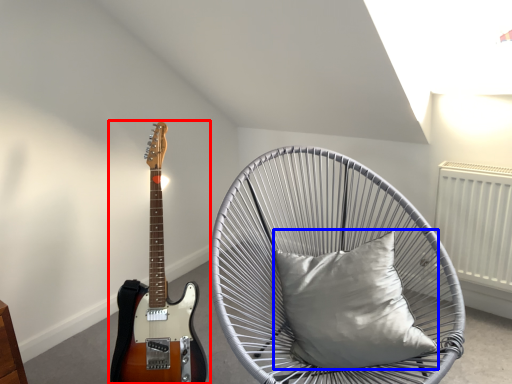
Question: Which of the following is the closest to the observer, guitar (highlighted by a red box) or pillow (highlighted by a blue box)?

Choices:
 (A) guitar
 (B) pillow

Answer: (A)